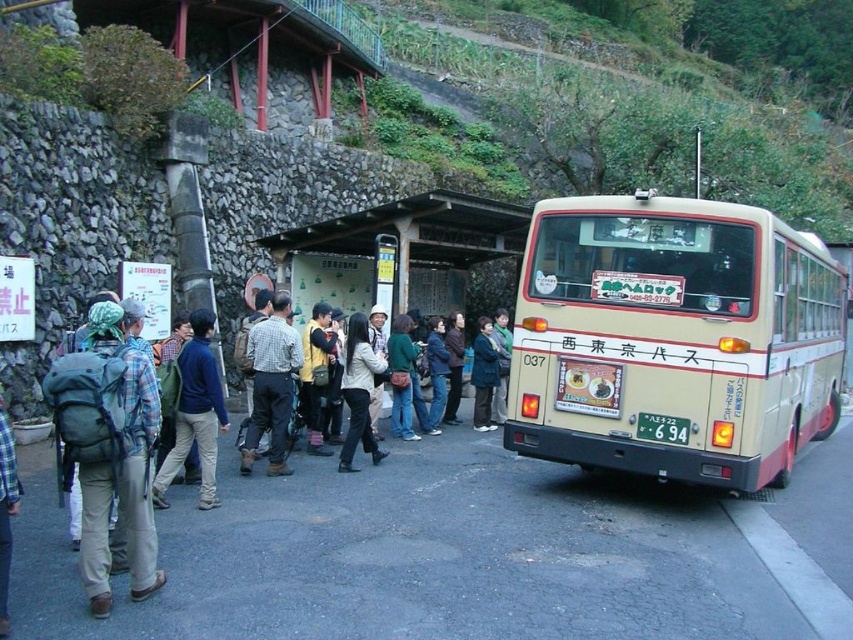
You are standing at the bus stop and see a white matte jacket at center and a white plastic license plate at center. Which one is positioned to the left side?

The white matte jacket at center is positioned to the left of the white plastic license plate at center.